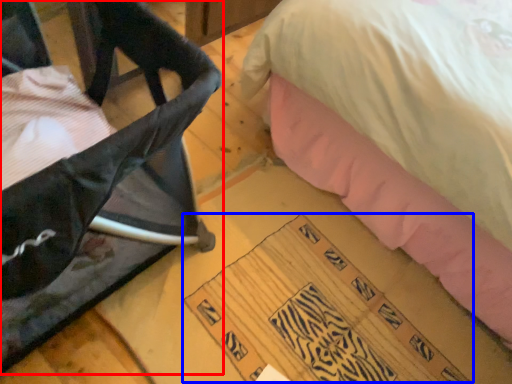
Question: Which of the following is the closest to the observer, furniture (highlighted by a red box) or writing (highlighted by a blue box)?

Choices:
 (A) furniture
 (B) writing

Answer: (A)